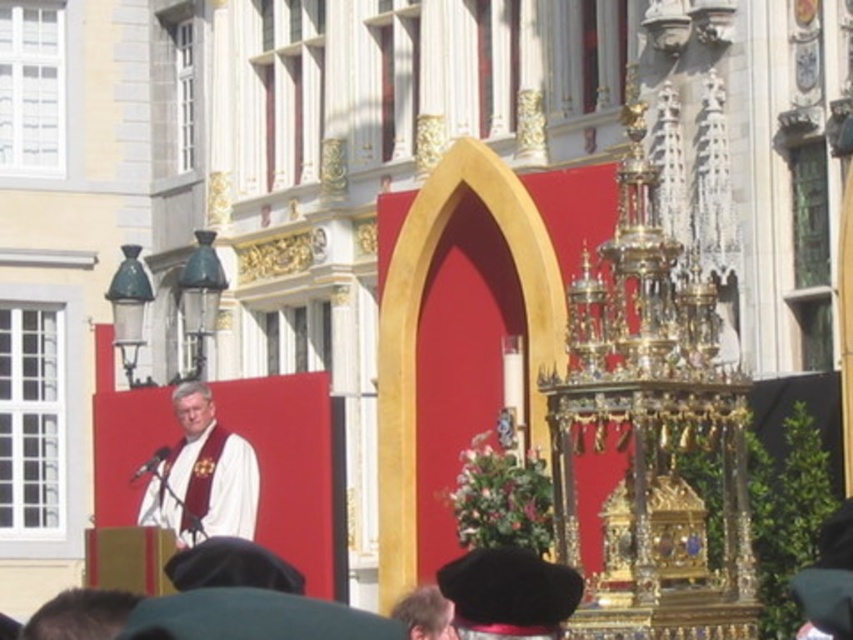
You are an event planner arranging decorations for the ceremony. You need to place a decorative item between the white cloth at center and the black felt hat at lower center. Which object should be placed closer to the front of the stage?

The black felt hat at lower center should be placed closer to the front of the stage because the white cloth at center is not as tall as the black felt hat at lower center, implying the hat is positioned lower and closer to the front.

You are attending a ceremony and want to place a small flower bouquet between the white cloth at center and the black felt hat at lower center. Which object should you place it closer to if you want it to be closer to the front of the scene?

The white cloth at center is further to the viewer than the black felt hat at lower center, so placing the bouquet closer to the white cloth at center would position it nearer to the front of the scene.

You are attending a ceremony and notice two items in the scene. The white cloth at center and the black felt hat at lower center. Which item is positioned higher from the ground?

The white cloth at center is above the black felt hat at lower center, so it is positioned higher from the ground.